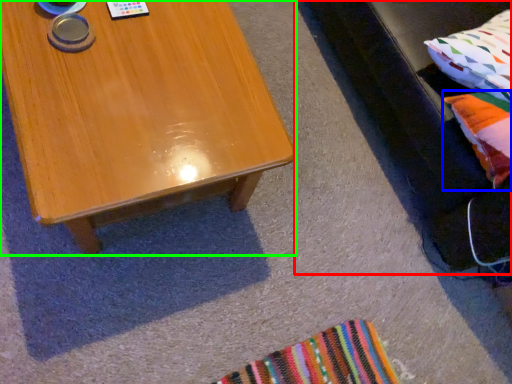
Question: Which object is the closest to the couch (highlighted by a red box)? Choose among these: pillow (highlighted by a blue box) or coffee table (highlighted by a green box).

Choices:
 (A) pillow
 (B) coffee table

Answer: (A)